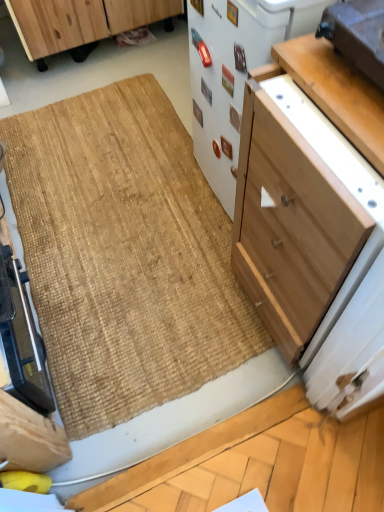
The image size is (384, 512). Identify the location of vacant region below natural fiber doormat at center (from a real-world perspective). (136, 218).